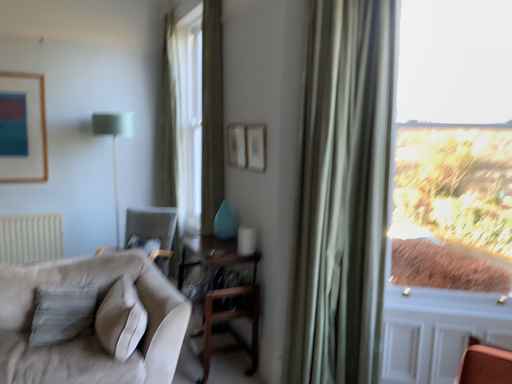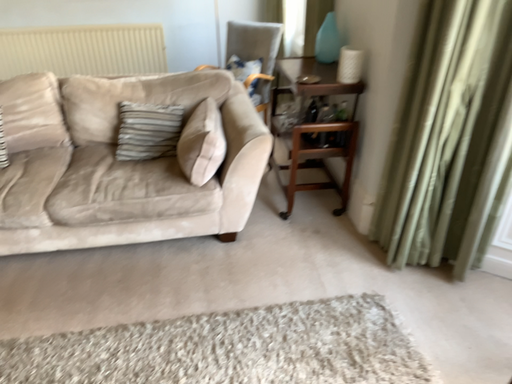
Question: Which way did the camera rotate in the video?

Choices:
 (A) rotated downward
 (B) rotated upward

Answer: (A)